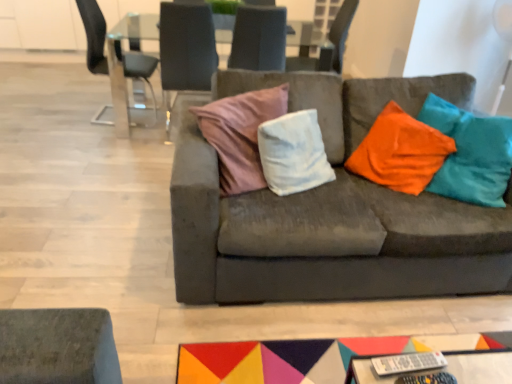
At what (x,y) coordinates should I click in order to perform the action: click on free space to the left of metallic glass chair at upper left, the first chair from the left. Please return your answer as a coordinate pair (x, y). The image size is (512, 384). Looking at the image, I should click on (62, 112).